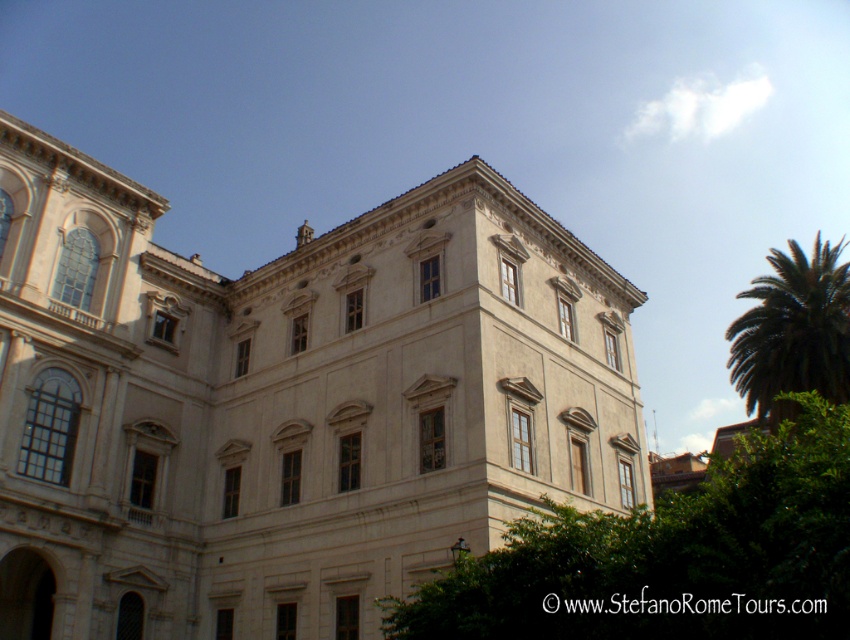
Can you confirm if green leafy tree at center is shorter than green leafy palm at upper right?

Correct, green leafy tree at center is not as tall as green leafy palm at upper right.

Who is more forward, (689, 605) or (820, 346)?

Point (689, 605) is in front.

Is point (460, 604) farther from viewer compared to point (752, 326)?

No, (460, 604) is closer to viewer.

Image resolution: width=850 pixels, height=640 pixels. I want to click on green leafy tree at center, so click(x=672, y=556).

Does point (639, 442) lie in front of point (792, 353)?

No, (639, 442) is behind (792, 353).

Is white stone building at center closer to camera compared to green leafy palm at upper right?

That is True.

Which is in front, point (609, 493) or point (768, 381)?

Point (609, 493)

This screenshot has height=640, width=850. In order to click on white stone building at center in this screenshot , I will do `click(287, 403)`.

Does point (264, 598) lie in front of point (724, 588)?

That is False.

Is point (106, 499) farther from viewer compared to point (735, 538)?

Yes, it is.

The height and width of the screenshot is (640, 850). Identify the location of white stone building at center. click(287, 403).